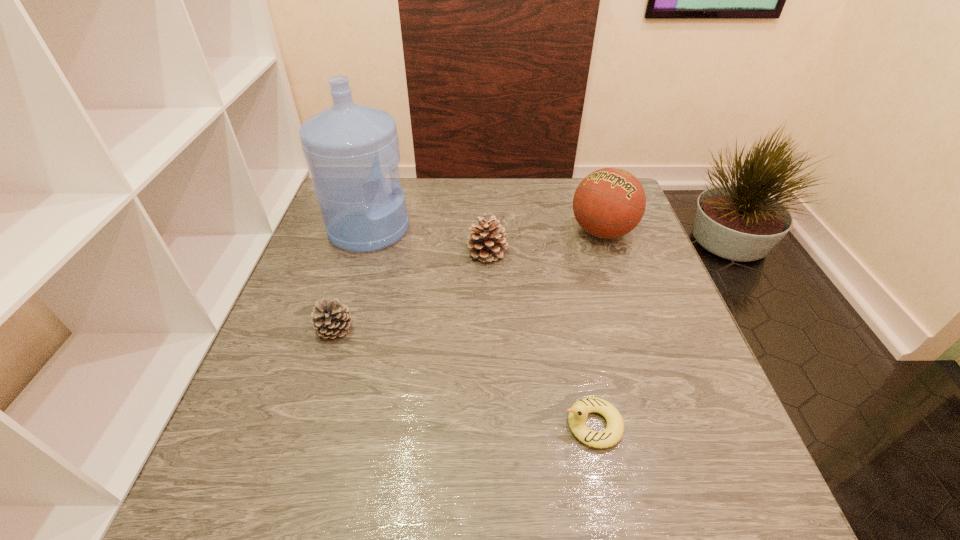
Where is `vacant space situated on the back of the farther pinecone`? The image size is (960, 540). vacant space situated on the back of the farther pinecone is located at coordinates pyautogui.click(x=486, y=178).

You are a GUI agent. You are given a task and a screenshot of the screen. Output one action in this format:
    pyautogui.click(x=<x>, y=<y>)
    Task: Click on the free point located 0.160m on the right of the shorter pinecone
    
    Given the screenshot: What is the action you would take?
    pyautogui.click(x=426, y=329)

Locate an element on the screen. free region located 0.220m on the face of the duckling is located at coordinates (442, 425).

At what (x,y) coordinates should I click in order to perform the action: click on free spot located 0.270m on the face of the duckling. Please return your answer as a coordinate pair (x, y). Looking at the image, I should click on (415, 425).

You are a GUI agent. You are given a task and a screenshot of the screen. Output one action in this format:
    pyautogui.click(x=<x>, y=<y>)
    Task: Click on the vacant space located 0.260m on the face of the duckling
    Image resolution: width=960 pixels, height=540 pixels.
    Given the screenshot: What is the action you would take?
    pyautogui.click(x=420, y=425)

The image size is (960, 540). In order to click on water jug that is positioned at the far edge in this screenshot , I will do `click(349, 148)`.

This screenshot has width=960, height=540. I want to click on basketball that is at the far edge, so click(x=610, y=202).

Locate an element on the screen. The image size is (960, 540). water jug that is at the left edge is located at coordinates (349, 148).

Locate an element on the screen. This screenshot has height=540, width=960. pinecone located at the left edge is located at coordinates (331, 319).

Identify the location of object that is at the right edge. This screenshot has width=960, height=540. coord(610,202).